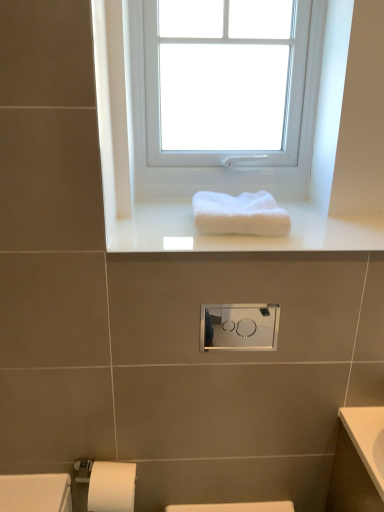
Question: Considering their positions, is white fluffy towel at center located in front of or behind white glossy towel at upper center?

Choices:
 (A) behind
 (B) front

Answer: (A)

Question: In terms of width, does white fluffy towel at center look wider or thinner when compared to white glossy towel at upper center?

Choices:
 (A) wide
 (B) thin

Answer: (B)

Question: Estimate the real-world distances between objects in this image. Which object is farther from the white fluffy towel at center?

Choices:
 (A) white plastic window at upper center
 (B) satin silver medicine cabinet at center
 (C) white glossy towel at upper center

Answer: (A)

Question: Which is farther from the white plastic window at upper center?

Choices:
 (A) white glossy towel at upper center
 (B) satin silver medicine cabinet at center
 (C) white fluffy towel at center

Answer: (B)